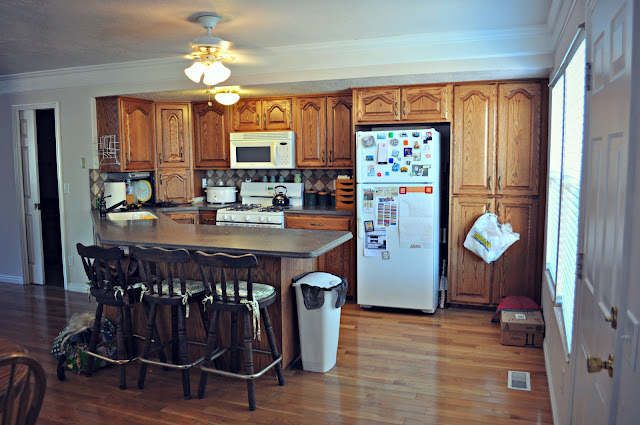
In order to click on microwave in this screenshot , I will do `click(258, 155)`.